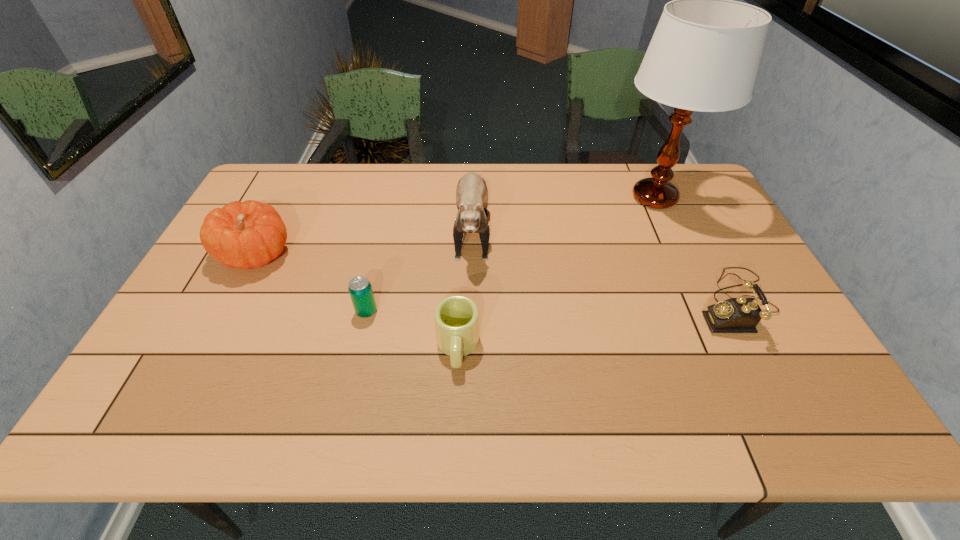
Identify the location of unoccupied position between the telephone and the second object from left to right. The height and width of the screenshot is (540, 960). (551, 307).

Locate an element on the screen. free space between the mug and the fifth shortest object is located at coordinates (465, 286).

This screenshot has width=960, height=540. I want to click on vacant space that's between the ferret and the mug, so click(x=465, y=286).

You are a GUI agent. You are given a task and a screenshot of the screen. Output one action in this format:
    pyautogui.click(x=<x>, y=<y>)
    Task: Click on the free space between the beer can and the fifth shortest object
    
    Given the screenshot: What is the action you would take?
    pyautogui.click(x=420, y=268)

Find the location of a particular element. empty space between the mug and the fifth object from right to left is located at coordinates (412, 329).

Point out which object is positioned as the fourth nearest to the tallest object. Please provide its 2D coordinates. Your answer should be formatted as a tuple, i.e. [(x, y)], where the tuple contains the x and y coordinates of a point satisfying the conditions above.

[(360, 289)]

At what (x,y) coordinates should I click in order to perform the action: click on object that stands as the fifth closest to the mug. Please return your answer as a coordinate pair (x, y). This screenshot has width=960, height=540. Looking at the image, I should click on 704,55.